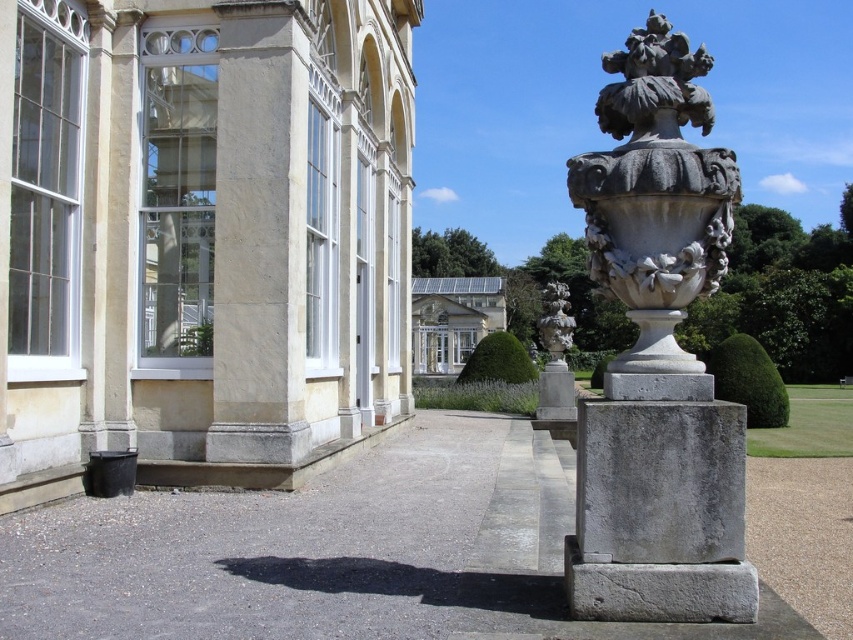
Question: In this image, where is white stone palace at center located relative to gray stone vase at center?

Choices:
 (A) left
 (B) right

Answer: (A)

Question: Does beige stone building at center appear on the right side of white stone vase at center?

Choices:
 (A) yes
 (B) no

Answer: (B)

Question: Which of these objects is positioned farthest from the beige stone building at center?

Choices:
 (A) white stone palace at center
 (B) gray stone vase at center
 (C) white stone vase at center

Answer: (A)

Question: Which object is closer to the camera taking this photo?

Choices:
 (A) white stone vase at center
 (B) gray stone vase at center
 (C) white stone palace at center
 (D) beige stone building at center

Answer: (A)

Question: Does beige stone building at center appear on the left side of gray stone vase at center?

Choices:
 (A) yes
 (B) no

Answer: (A)

Question: Which object is the closest to the white stone vase at center?

Choices:
 (A) beige stone building at center
 (B) gray stone vase at center
 (C) white stone palace at center

Answer: (A)